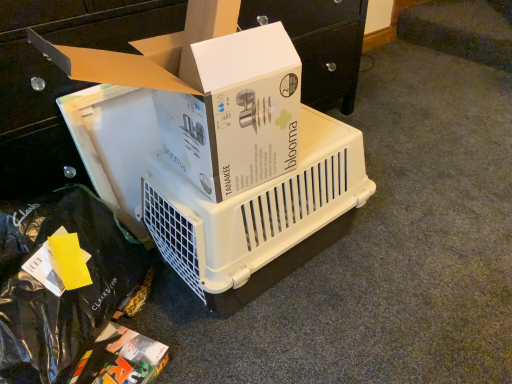
Question: Does white plastic pet carrier at center have a larger size compared to black plastic bag at lower left?

Choices:
 (A) yes
 (B) no

Answer: (B)

Question: Could black plastic bag at lower left be considered to be inside white plastic pet carrier at center?

Choices:
 (A) yes
 (B) no

Answer: (B)

Question: Is white plastic pet carrier at center located outside black plastic bag at lower left?

Choices:
 (A) yes
 (B) no

Answer: (A)

Question: Is white plastic pet carrier at center oriented away from black plastic bag at lower left?

Choices:
 (A) no
 (B) yes

Answer: (A)

Question: Does white plastic pet carrier at center come behind black plastic bag at lower left?

Choices:
 (A) no
 (B) yes

Answer: (B)

Question: Is white plastic pet carrier at center aimed at black plastic bag at lower left?

Choices:
 (A) yes
 (B) no

Answer: (B)

Question: Is white cardboard box at upper center, positioned as the third box in bottom-to-top order, oriented away from multicolored cardboard box at lower left, the third box positioned from the top?

Choices:
 (A) yes
 (B) no

Answer: (B)

Question: Is white cardboard box at upper center, the 1th box positioned from the top, further to camera compared to multicolored cardboard box at lower left, the third box positioned from the top?

Choices:
 (A) no
 (B) yes

Answer: (A)

Question: From the image's perspective, is white cardboard box at upper center, the 1th box positioned from the top, above multicolored cardboard box at lower left, the third box positioned from the top?

Choices:
 (A) yes
 (B) no

Answer: (A)

Question: From the image's perspective, is white cardboard box at upper center, the 1th box positioned from the top, located beneath multicolored cardboard box at lower left, placed as the first box when sorted from bottom to top?

Choices:
 (A) no
 (B) yes

Answer: (A)

Question: Considering the relative positions of white cardboard box at upper center, the 1th box positioned from the top, and multicolored cardboard box at lower left, the third box positioned from the top, in the image provided, is white cardboard box at upper center, the 1th box positioned from the top, to the left of multicolored cardboard box at lower left, the third box positioned from the top, from the viewer's perspective?

Choices:
 (A) no
 (B) yes

Answer: (A)

Question: Are white cardboard box at upper center, positioned as the third box in bottom-to-top order, and multicolored cardboard box at lower left, placed as the first box when sorted from bottom to top, far apart?

Choices:
 (A) yes
 (B) no

Answer: (B)

Question: Is white plastic pet carrier at center far away from multicolored cardboard box at lower left, placed as the first box when sorted from bottom to top?

Choices:
 (A) no
 (B) yes

Answer: (A)